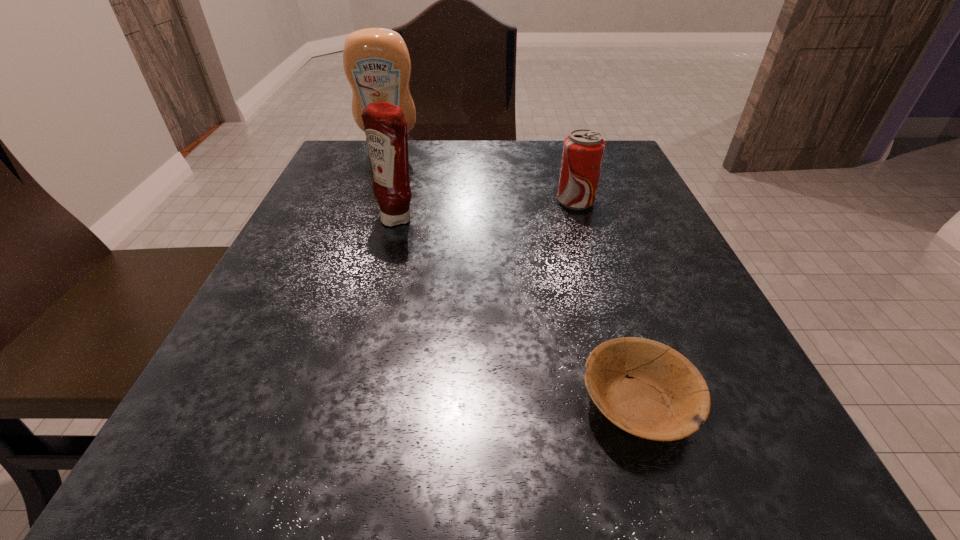
This screenshot has height=540, width=960. Identify the location of free space at the right edge. (646, 214).

In the image, there is a desktop. Where is `vacant area at the far left corner`? The width and height of the screenshot is (960, 540). vacant area at the far left corner is located at coordinates (364, 178).

Identify the location of free space at the near left corner of the desktop. The image size is (960, 540). (230, 440).

I want to click on free space at the far right corner, so click(607, 168).

At what (x,y) coordinates should I click in order to perform the action: click on unoccupied position between the shortest object and the soda can. Please return your answer as a coordinate pair (x, y). Looking at the image, I should click on (607, 302).

Where is `free space between the third shortest object and the second shortest object`? free space between the third shortest object and the second shortest object is located at coordinates (487, 210).

Where is `free space between the bowl and the farther condiment`? The width and height of the screenshot is (960, 540). free space between the bowl and the farther condiment is located at coordinates (514, 276).

This screenshot has width=960, height=540. In order to click on vacant area that lies between the second shortest object and the bowl in this screenshot , I will do `click(607, 302)`.

This screenshot has height=540, width=960. What are the coordinates of `free point between the nearer condiment and the soda can` in the screenshot? It's located at (487, 210).

Locate an element on the screen. The height and width of the screenshot is (540, 960). free space between the third tallest object and the shorter condiment is located at coordinates (487, 210).